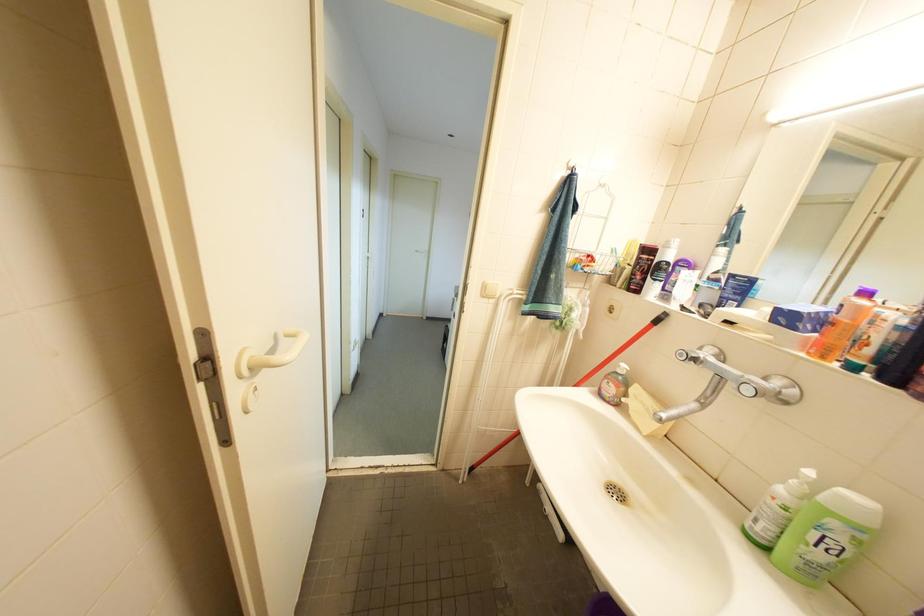
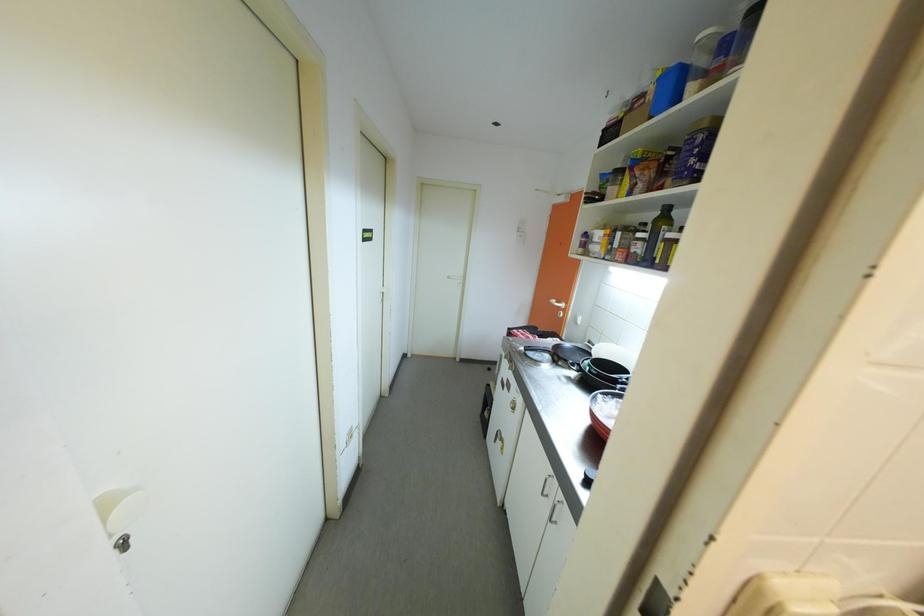
Question: Based on the continuous images, in which direction is the camera rotating? Reply with the corresponding letter.

Choices:
 (A) Left
 (B) Right
 (C) Up
 (D) Down

Answer: (A)